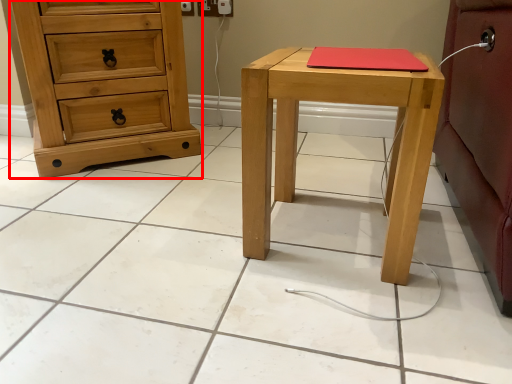
Question: From the image's perspective, where is chest of drawers (annotated by the red box) located relative to stool?

Choices:
 (A) below
 (B) above

Answer: (B)